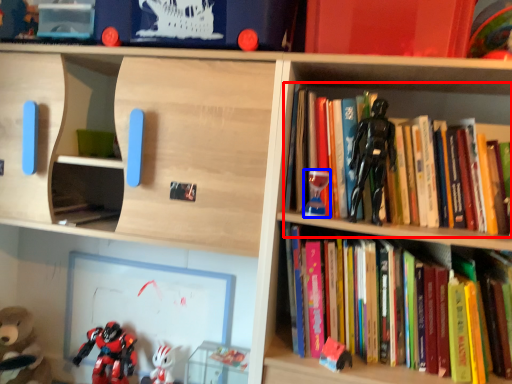
Question: Which point is closer to the camera, book (highlighted by a red box) or toy (highlighted by a blue box)?

Choices:
 (A) book
 (B) toy

Answer: (A)